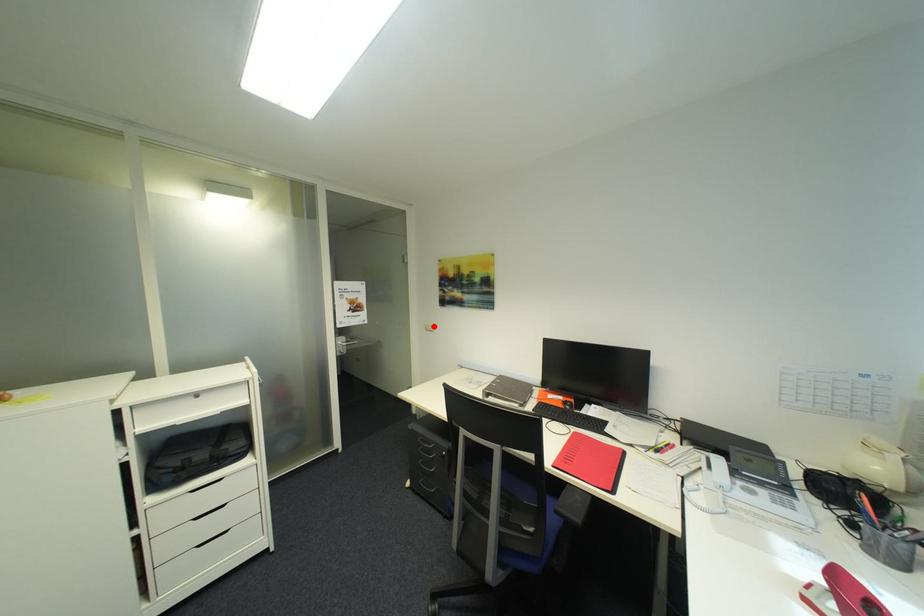
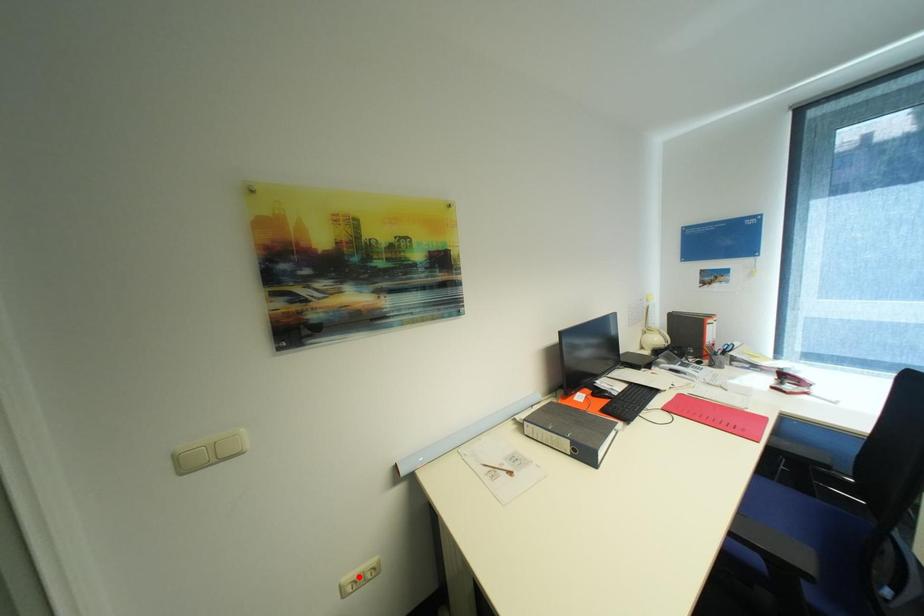
I am providing you with two images of the same scene from different viewpoints. A red point is marked on the first image and another point is marked on the second image. Is the red point in image1 aligned with the point shown in image2?

No